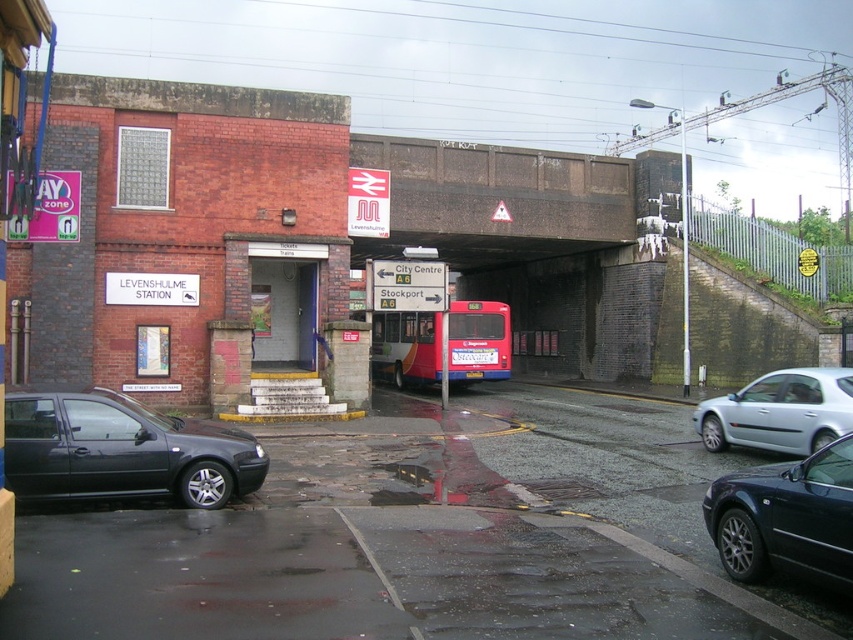
Question: Can you confirm if matte black car at lower left is positioned to the right of white plastic license plate at center?

Choices:
 (A) yes
 (B) no

Answer: (B)

Question: Which of the following is the farthest from the observer?

Choices:
 (A) red matte bus at center
 (B) matte black car at lower left
 (C) silver metallic car at right
 (D) shiny black sedan at lower right

Answer: (A)

Question: From the image, what is the correct spatial relationship of shiny black sedan at lower right in relation to silver metallic car at right?

Choices:
 (A) below
 (B) above

Answer: (A)

Question: Which of the following is the farthest from the observer?

Choices:
 (A) 469,356
 (B) 466,186
 (C) 73,496

Answer: (A)

Question: Which object is positioned farthest from the shiny black sedan at lower right?

Choices:
 (A) red matte bus at center
 (B) silver metallic car at right

Answer: (A)

Question: Can you confirm if matte black car at lower left is bigger than silver metallic car at right?

Choices:
 (A) yes
 (B) no

Answer: (A)